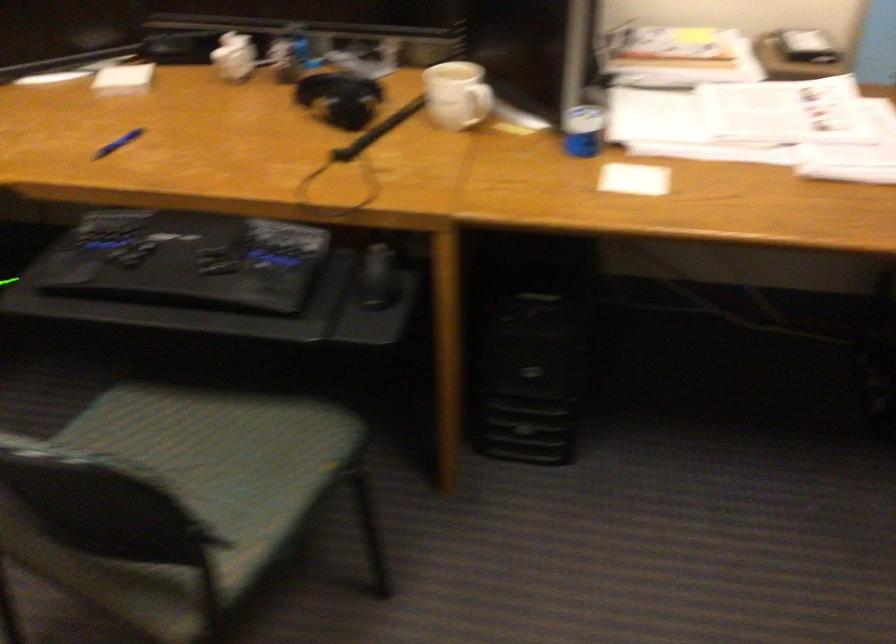
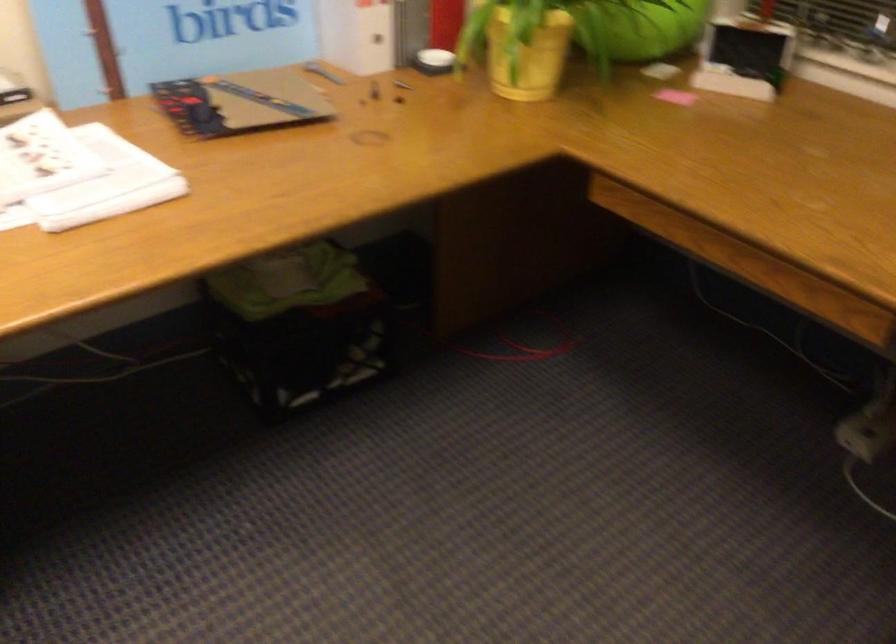
Question: The images are taken continuously from a first-person perspective. In which direction is your viewpoint rotating?

Choices:
 (A) Left
 (B) Right
 (C) Up
 (D) Down

Answer: (B)